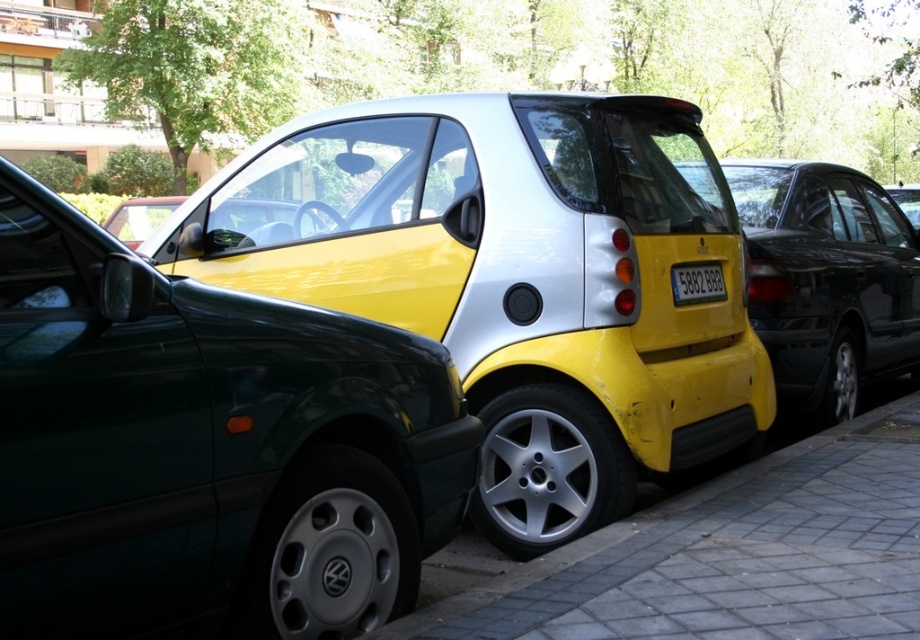
Question: Which of the following is the farthest from the observer?

Choices:
 (A) (135, 410)
 (B) (778, 195)
 (C) (700, 276)

Answer: (B)

Question: Which point is farther to the camera?

Choices:
 (A) yellow matte/silver smart car at center
 (B) metallic green car at left
 (C) yellow matte/silver car at center

Answer: (A)

Question: Is yellow matte/silver car at center bigger than yellow matte/silver smart car at center?

Choices:
 (A) no
 (B) yes

Answer: (A)

Question: Estimate the real-world distances between objects in this image. Which object is closer to the yellow matte/silver car at center?

Choices:
 (A) metallic green car at left
 (B) yellow matte/silver smart car at center
 (C) black plastic license plate at rear

Answer: (C)

Question: Is yellow matte/silver car at center bigger than yellow matte/silver smart car at center?

Choices:
 (A) no
 (B) yes

Answer: (A)

Question: Where is yellow matte/silver car at center located in relation to yellow matte/silver smart car at center in the image?

Choices:
 (A) left
 (B) right

Answer: (A)